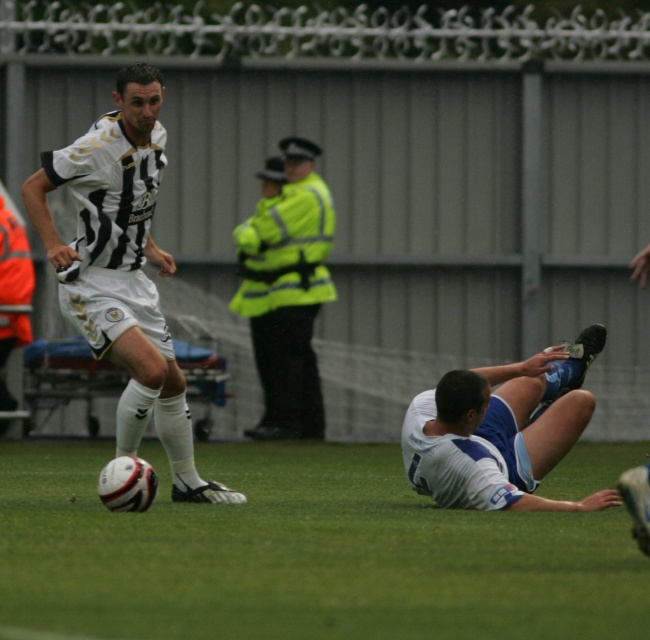
Which of these two, white striped jersey at center or white matte jersey at lower right, stands shorter?

white matte jersey at lower right

Does white striped jersey at center have a larger size compared to white matte jersey at lower right?

Correct, white striped jersey at center is larger in size than white matte jersey at lower right.

Does point (73, 170) come closer to viewer compared to point (582, 413)?

Yes, point (73, 170) is closer to viewer.

I want to click on white striped jersey at center, so (122, 268).

Between white matte jersey at lower right and high visibility jacket at center, which one is positioned lower?

white matte jersey at lower right is lower down.

Is point (489, 376) less distant than point (304, 244)?

Yes, point (489, 376) is in front of point (304, 244).

What do you see at coordinates (500, 432) in the screenshot? This screenshot has width=650, height=640. I see `white matte jersey at lower right` at bounding box center [500, 432].

Locate an element on the screen. This screenshot has height=640, width=650. white matte jersey at lower right is located at coordinates (500, 432).

Which of these two, white striped jersey at center or high visibility jacket at center, stands taller?

Standing taller between the two is high visibility jacket at center.

Is white striped jersey at center thinner than high visibility jacket at center?

No.

The width and height of the screenshot is (650, 640). What do you see at coordinates (122, 268) in the screenshot?
I see `white striped jersey at center` at bounding box center [122, 268].

Identify the location of white striped jersey at center. The width and height of the screenshot is (650, 640). (122, 268).